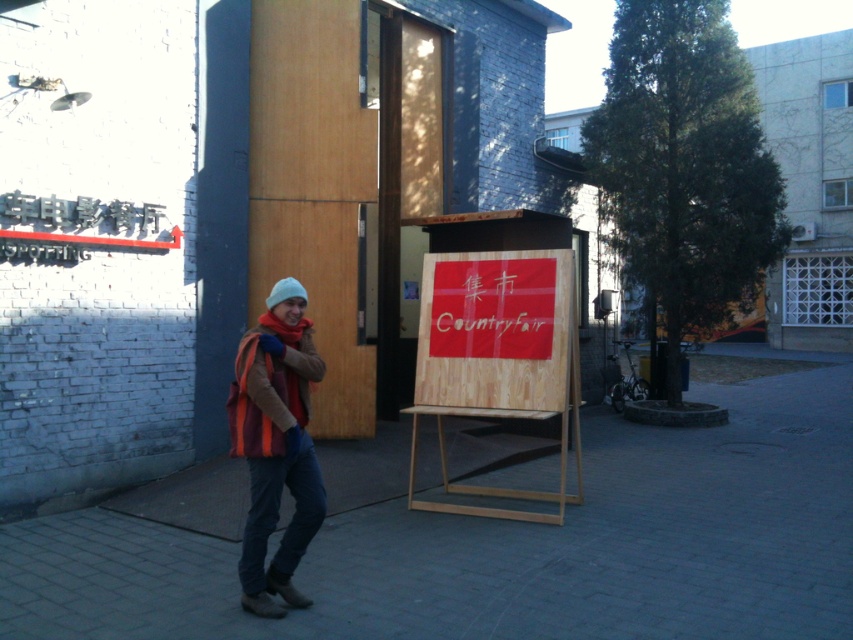
Question: Which object is positioned closest to the knitted woolen hat at center?

Choices:
 (A) brick pavement at center
 (B) white knit hat at center
 (C) wooden sign at center
 (D) brown suede jacket at center

Answer: (D)

Question: Which object appears farthest from the camera in this image?

Choices:
 (A) wooden sign at center
 (B) brown suede jacket at center
 (C) brick pavement at center

Answer: (A)

Question: Can you confirm if brick pavement at center is bigger than wooden sign at center?

Choices:
 (A) no
 (B) yes

Answer: (B)

Question: Does knitted woolen hat at center have a lesser width compared to brown suede jacket at center?

Choices:
 (A) no
 (B) yes

Answer: (A)

Question: Which object appears farthest from the camera in this image?

Choices:
 (A) white knit hat at center
 (B) wooden sign at center

Answer: (A)

Question: Can you confirm if brick pavement at center is bigger than white knit hat at center?

Choices:
 (A) no
 (B) yes

Answer: (B)